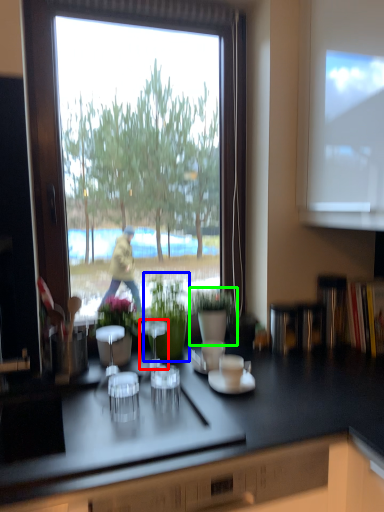
Question: Based on their relative distances, which object is farther from appliance (highlighted by a red box)? Choose from houseplant (highlighted by a blue box) and houseplant (highlighted by a green box).

Choices:
 (A) houseplant
 (B) houseplant

Answer: (B)